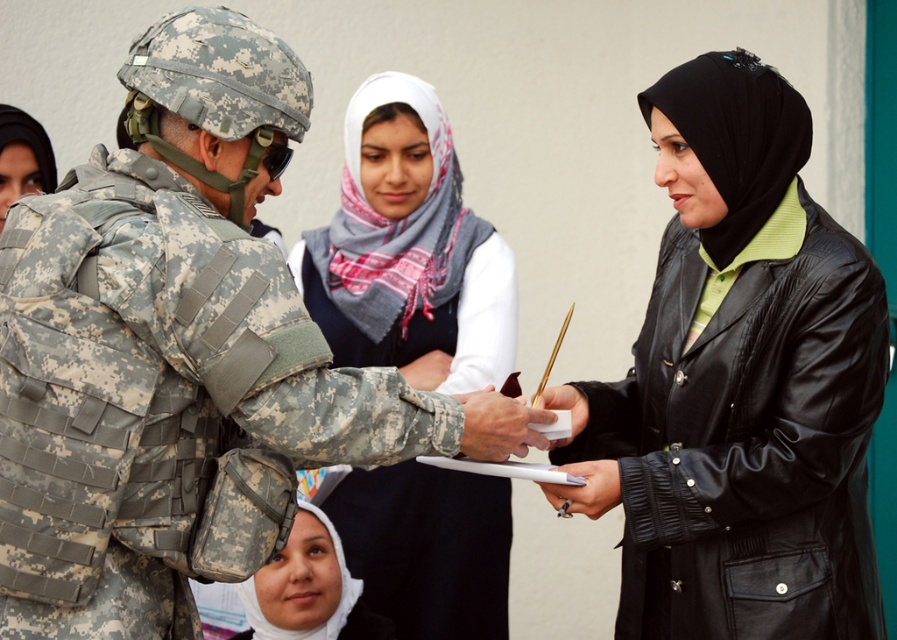
Is white scarf at center closer to camera compared to black leather pen at center?

No, it is behind black leather pen at center.

Does white scarf at center have a lesser height compared to black leather pen at center?

No, white scarf at center is not shorter than black leather pen at center.

Measure the distance between point (375, 314) and camera.

A distance of 3.27 meters exists between point (375, 314) and camera.

Locate an element on the screen. white scarf at center is located at coordinates (408, 250).

Does white matte hijab at lower center have a greater height compared to matte white paper at center?

Correct, white matte hijab at lower center is much taller as matte white paper at center.

This screenshot has height=640, width=897. What do you see at coordinates (308, 589) in the screenshot?
I see `white matte hijab at lower center` at bounding box center [308, 589].

Locate an element on the screen. The height and width of the screenshot is (640, 897). white matte hijab at lower center is located at coordinates (308, 589).

Locate an element on the screen. white matte hijab at lower center is located at coordinates (308, 589).

Locate an element on the screen. Image resolution: width=897 pixels, height=640 pixels. camouflage uniform at center is located at coordinates (166, 340).

Is camouflage uniform at center bigger than black leather pen at center?

Correct, camouflage uniform at center is larger in size than black leather pen at center.

Does point (242, 282) lie in front of point (565, 468)?

Yes, point (242, 282) is in front of point (565, 468).

This screenshot has height=640, width=897. Identify the location of camouflage uniform at center. (166, 340).